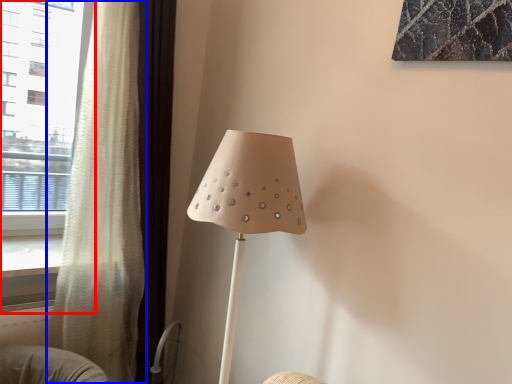
Question: Which point is further to the camera, window (highlighted by a red box) or curtain (highlighted by a blue box)?

Choices:
 (A) window
 (B) curtain

Answer: (A)